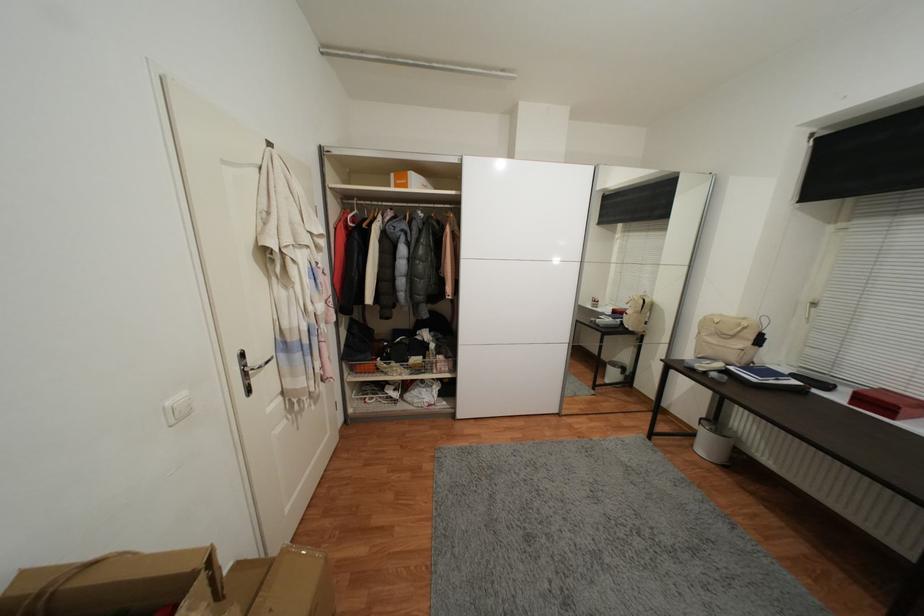
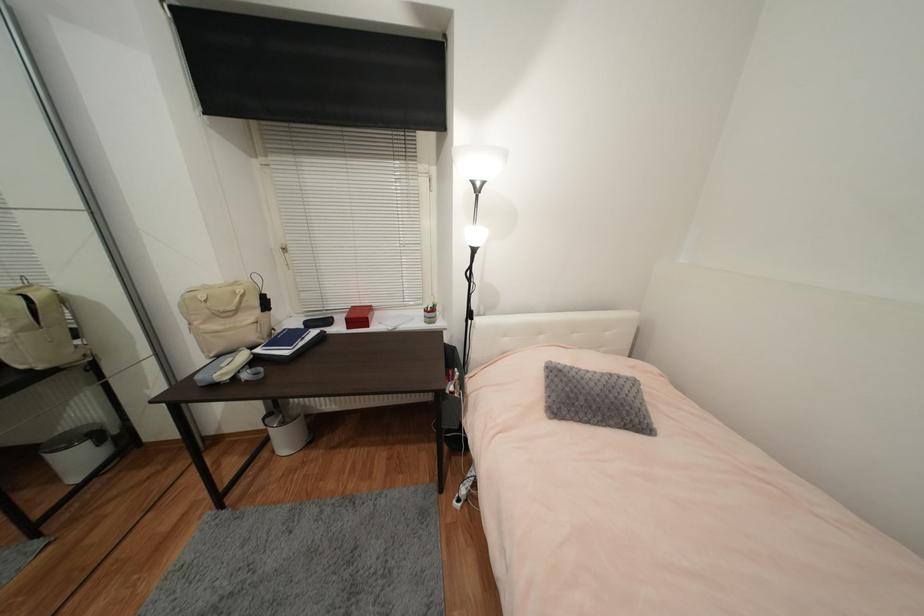
Find the pixel in the second image that matches (x=776, y=383) in the first image.

(306, 344)